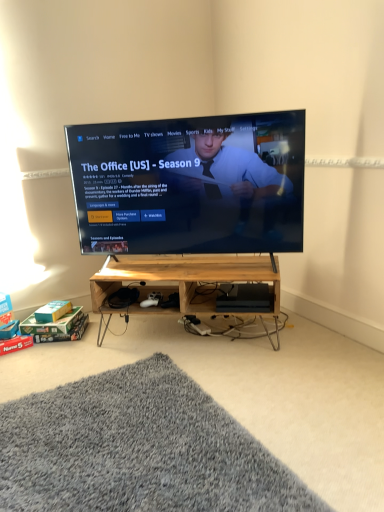
Question: Are gray shaggy rug at lower left and wooden at center, placed as the second shelf when sorted from top to bottom, far apart?

Choices:
 (A) yes
 (B) no

Answer: (B)

Question: Is gray shaggy rug at lower left in front of wooden at center, placed as the second shelf when sorted from top to bottom?

Choices:
 (A) no
 (B) yes

Answer: (B)

Question: Is gray shaggy rug at lower left facing away from wooden at center, the 1th shelf when ordered from bottom to top?

Choices:
 (A) yes
 (B) no

Answer: (B)

Question: Is gray shaggy rug at lower left bigger than wooden at center, placed as the second shelf when sorted from top to bottom?

Choices:
 (A) no
 (B) yes

Answer: (A)

Question: Does gray shaggy rug at lower left have a lesser width compared to wooden at center, the 1th shelf when ordered from bottom to top?

Choices:
 (A) no
 (B) yes

Answer: (A)

Question: Could you tell me if gray shaggy rug at lower left is turned towards wooden at center, placed as the second shelf when sorted from top to bottom?

Choices:
 (A) yes
 (B) no

Answer: (B)

Question: Is gray shaggy rug at lower left outside matte black tv at center?

Choices:
 (A) yes
 (B) no

Answer: (A)

Question: Is gray shaggy rug at lower left beside matte black tv at center?

Choices:
 (A) no
 (B) yes

Answer: (A)

Question: From the image's perspective, does gray shaggy rug at lower left appear higher than matte black tv at center?

Choices:
 (A) no
 (B) yes

Answer: (A)

Question: From the image's perspective, is gray shaggy rug at lower left below matte black tv at center?

Choices:
 (A) yes
 (B) no

Answer: (A)

Question: Does gray shaggy rug at lower left appear on the left side of matte black tv at center?

Choices:
 (A) yes
 (B) no

Answer: (A)

Question: Can you confirm if gray shaggy rug at lower left is shorter than matte black tv at center?

Choices:
 (A) no
 (B) yes

Answer: (B)

Question: From the image's perspective, is wooden at center, placed as the second shelf when sorted from top to bottom, located above gray shaggy rug at lower left?

Choices:
 (A) yes
 (B) no

Answer: (A)